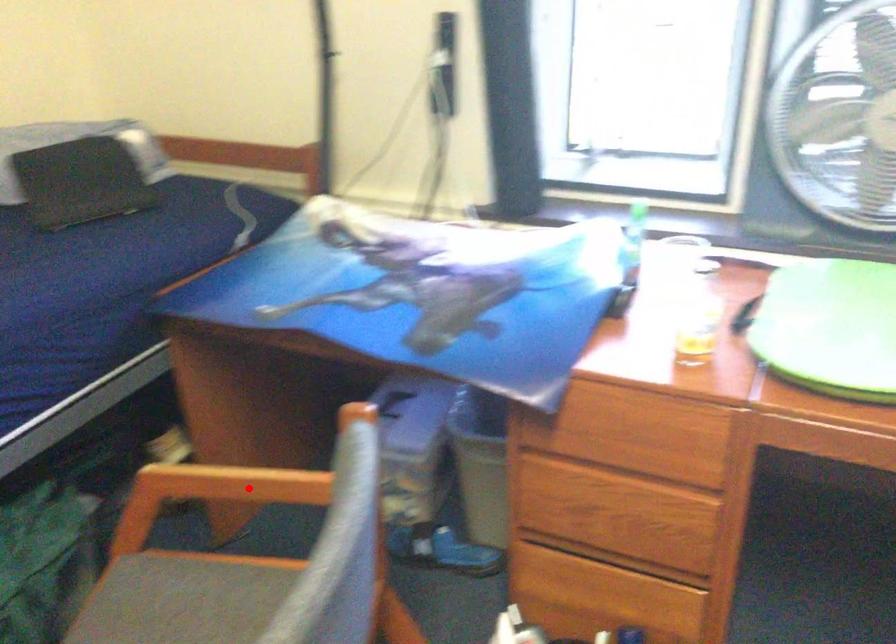
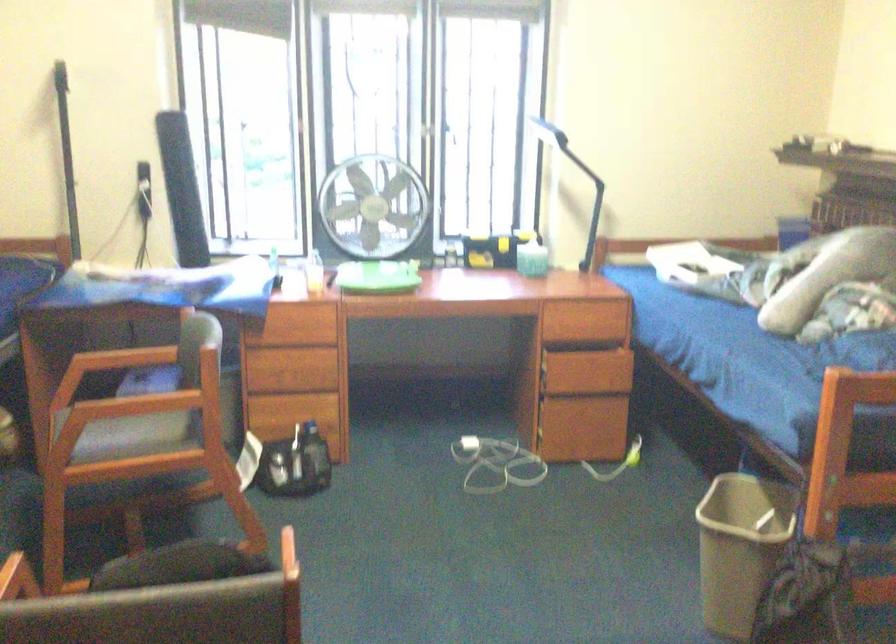
Question: A red point is marked in image1. In image2, is the corresponding 3D point closer to the camera or farther? Reply with the corresponding letter.

Choices:
 (A) The corresponding 3D point is closer.
 (B) The corresponding 3D point is farther.

Answer: (B)